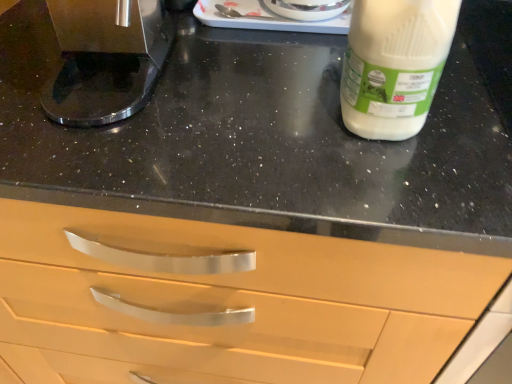
Question: Is point (132, 97) positioned closer to the camera than point (417, 117)?

Choices:
 (A) closer
 (B) farther

Answer: (B)

Question: Looking at the image, does shiny metallic coffee machine at left seem bigger or smaller compared to white plastic bottle at upper right?

Choices:
 (A) small
 (B) big

Answer: (B)

Question: Is shiny metallic coffee machine at left wider or thinner than white plastic bottle at upper right?

Choices:
 (A) wide
 (B) thin

Answer: (A)

Question: From the image's perspective, is white plastic bottle at upper right located above or below shiny metallic coffee machine at left?

Choices:
 (A) below
 (B) above

Answer: (A)

Question: From a real-world perspective, is white plastic bottle at upper right above or below shiny metallic coffee machine at left?

Choices:
 (A) below
 (B) above

Answer: (B)

Question: Considering the positions of point (347, 96) and point (137, 4), is point (347, 96) closer or farther from the camera than point (137, 4)?

Choices:
 (A) closer
 (B) farther

Answer: (A)

Question: In the image, is white plastic bottle at upper right positioned in front of or behind shiny metallic coffee machine at left?

Choices:
 (A) front
 (B) behind

Answer: (A)